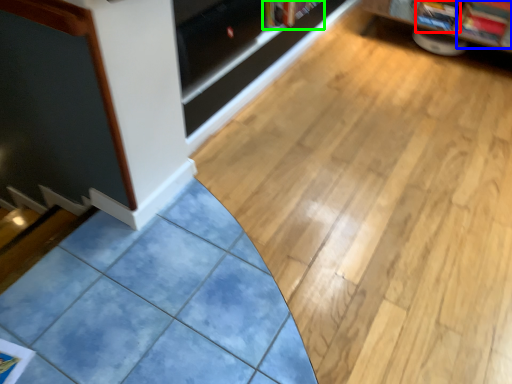
Question: Which object is positioned closest to magazine (highlighted by a red box)? Select from magazine (highlighted by a blue box) and book (highlighted by a green box).

Choices:
 (A) magazine
 (B) book

Answer: (A)